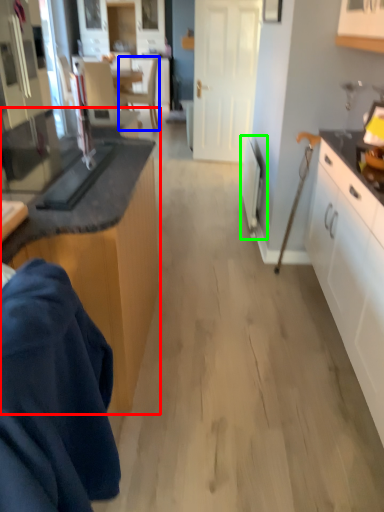
Question: Which object is positioned farthest from cabinetry (highlighted by a red box)? Select from chair (highlighted by a blue box) and appliance (highlighted by a green box).

Choices:
 (A) chair
 (B) appliance

Answer: (A)